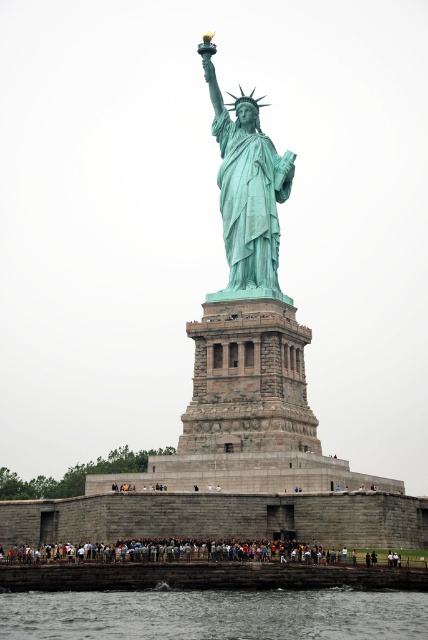
Question: Which point is farther from the camera taking this photo?

Choices:
 (A) (383, 637)
 (B) (59, 552)

Answer: (B)

Question: Can you confirm if green patina statue at center is positioned below dark gray concrete crowd at lower center?

Choices:
 (A) yes
 (B) no

Answer: (B)

Question: Which of the following is the closest to the observer?

Choices:
 (A) (372, 552)
 (B) (238, 288)

Answer: (A)

Question: Considering the relative positions of green patina statue at center and dark gray concrete crowd at lower center in the image provided, where is green patina statue at center located with respect to dark gray concrete crowd at lower center?

Choices:
 (A) right
 (B) left

Answer: (A)

Question: Is green patina statue at center behind dark gray concrete crowd at lower center?

Choices:
 (A) yes
 (B) no

Answer: (A)

Question: Which object appears closest to the camera in this image?

Choices:
 (A) green patina statue at center
 (B) dark gray concrete crowd at lower center
 (C) clear water at lower center

Answer: (C)